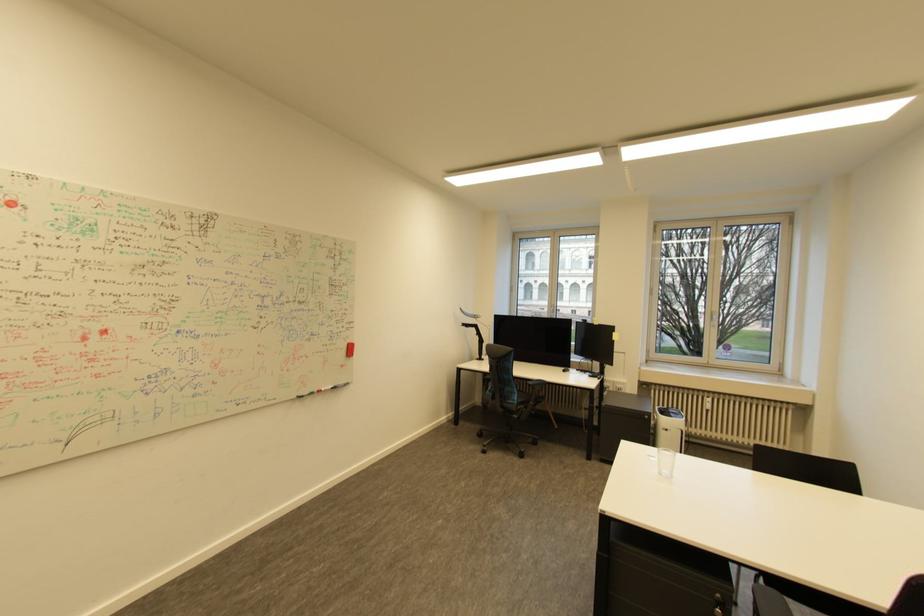
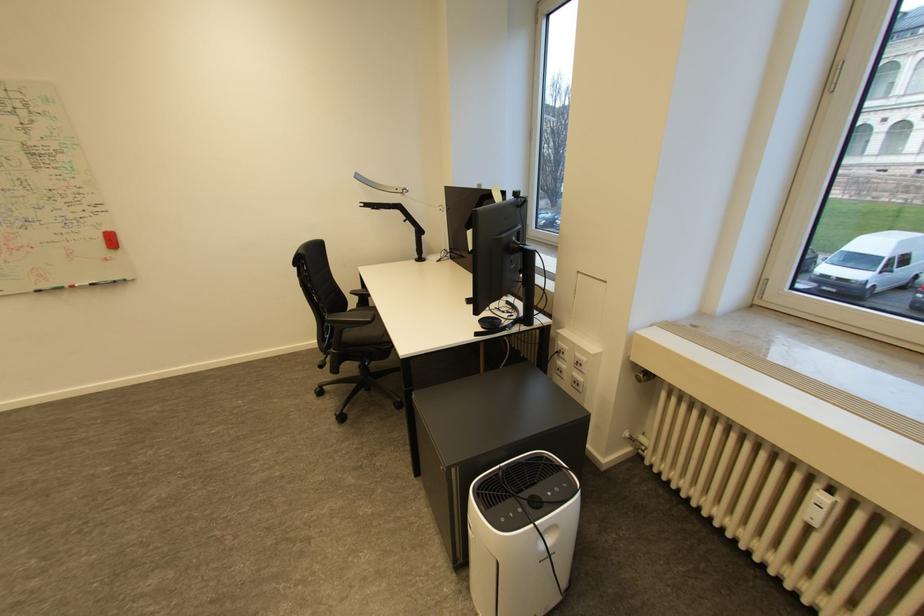
Where in the second image is the point corresponding to (x=480, y=330) from the first image?

(405, 213)